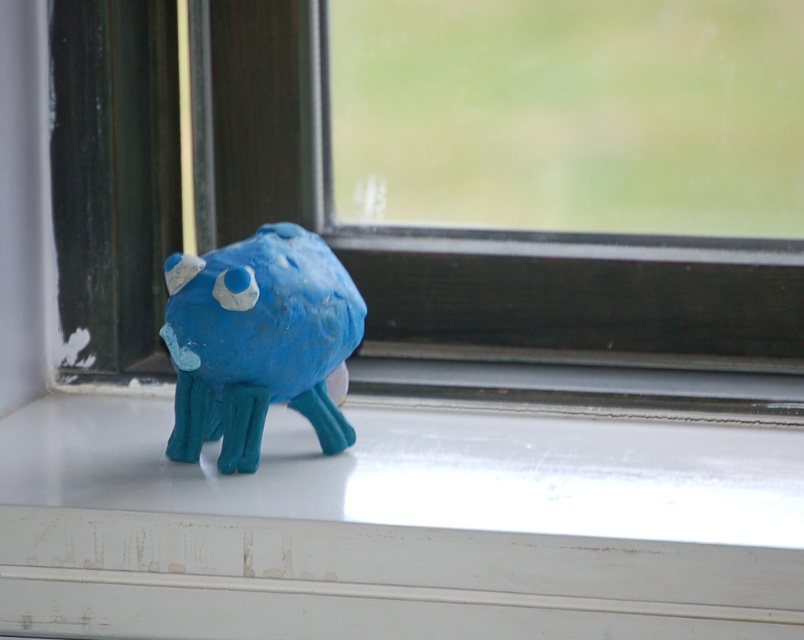
Question: Which of the following is the farthest from the observer?

Choices:
 (A) matte black window frame at center
 (B) matte clay monster at center
 (C) white painted wood at center

Answer: (A)

Question: Which point is closer to the camera?

Choices:
 (A) matte black window frame at center
 (B) white painted wood at center
 (C) matte clay monster at center

Answer: (B)

Question: Considering the relative positions of white painted wood at center and matte clay monster at center in the image provided, where is white painted wood at center located with respect to matte clay monster at center?

Choices:
 (A) above
 (B) below

Answer: (B)

Question: Does white painted wood at center have a lesser width compared to matte black window frame at center?

Choices:
 (A) no
 (B) yes

Answer: (A)

Question: Is matte black window frame at center to the left of matte clay monster at center from the viewer's perspective?

Choices:
 (A) no
 (B) yes

Answer: (A)

Question: Which point is farther to the camera?

Choices:
 (A) (166, 333)
 (B) (64, 225)
 (C) (109, 632)

Answer: (B)